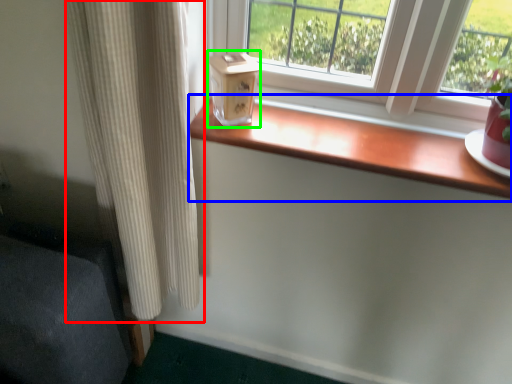
Question: Which object is positioned closest to curtain (highlighted by a red box)? Select from window sill (highlighted by a blue box) and window box (highlighted by a green box).

Choices:
 (A) window sill
 (B) window box

Answer: (B)